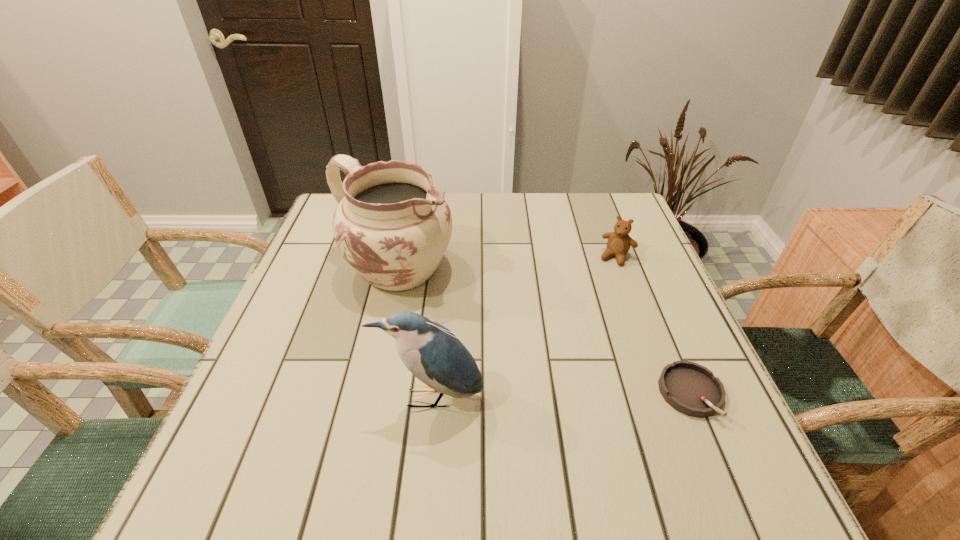
You are a GUI agent. You are given a task and a screenshot of the screen. Output one action in this format:
    pyautogui.click(x=<x>, y=<y>)
    Task: Click on the bird
    The width and height of the screenshot is (960, 540).
    Given the screenshot: What is the action you would take?
    pyautogui.click(x=432, y=353)

This screenshot has height=540, width=960. What are the coordinates of `the shortest object` in the screenshot? It's located at (690, 388).

Where is `pitcher`? This screenshot has height=540, width=960. pitcher is located at coordinates (392, 226).

At what (x,y) coordinates should I click in order to perform the action: click on teddy bear. Please return your answer as a coordinate pair (x, y). This screenshot has width=960, height=540. Looking at the image, I should click on [x=619, y=242].

You are a GUI agent. You are given a task and a screenshot of the screen. Output one action in this format:
    pyautogui.click(x=<x>, y=<y>)
    Task: Click on the vacant area situated at the tip of the bird's beak
    
    Given the screenshot: What is the action you would take?
    pyautogui.click(x=426, y=443)

The image size is (960, 540). What are the coordinates of `vacant space located on the left of the ashtray` in the screenshot? It's located at (592, 394).

Find the location of a particular element. The width and height of the screenshot is (960, 540). free space located 0.060m on the spout of the pitcher is located at coordinates (455, 305).

Identify the location of free location located on the spout of the pitcher. The width and height of the screenshot is (960, 540). (475, 318).

You are a GUI agent. You are given a task and a screenshot of the screen. Output one action in this format:
    pyautogui.click(x=<x>, y=<y>)
    Task: Click on the blank area located on the spout of the pitcher
    
    Given the screenshot: What is the action you would take?
    pyautogui.click(x=565, y=375)

I want to click on vacant area located on the front-facing side of the teddy bear, so click(x=601, y=284).